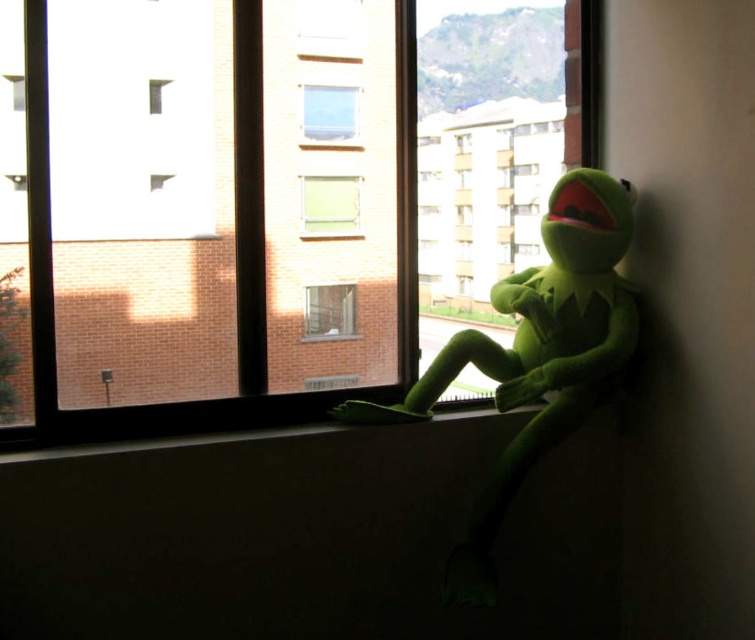
Which is behind, point (612, 387) or point (313, 301)?

Positioned behind is point (313, 301).

Is green plush toy at window shorter than clear glass window at center?

No, green plush toy at window is not shorter than clear glass window at center.

In order to click on green plush toy at window in this screenshot , I will do `click(538, 355)`.

Does point (604, 241) come farther from viewer compared to point (350, 227)?

No, (604, 241) is in front of (350, 227).

Is green plush toy at window behind green fabric curtain at center?

No, green plush toy at window is closer to the viewer.

Locate an element on the screen. This screenshot has height=640, width=755. green plush toy at window is located at coordinates (538, 355).

The width and height of the screenshot is (755, 640). Identify the location of green plush toy at window. (538, 355).

Can you confirm if clear glass window at upper center is taller than green fabric curtain at center?

No.

Based on the photo, who is shorter, clear glass window at upper center or green fabric curtain at center?

With less height is clear glass window at upper center.

Measure the distance between clear glass window at upper center and camera.

They are 7.33 feet apart.

Find the location of a particular element. clear glass window at upper center is located at coordinates (328, 29).